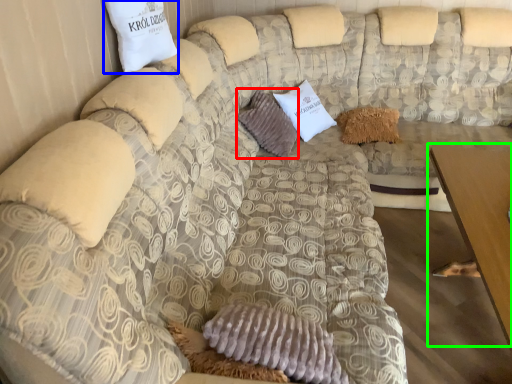
Question: Which object is positioned farthest from pillow (highlighted by a red box)? Select from pillow (highlighted by a blue box) and table (highlighted by a green box).

Choices:
 (A) pillow
 (B) table

Answer: (B)